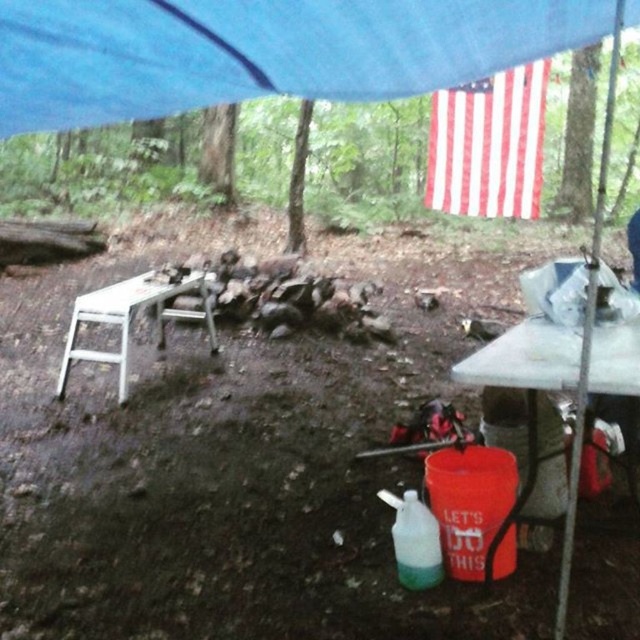
Question: Is red and white striped fabric at upper right wider than white metallic table at left?

Choices:
 (A) no
 (B) yes

Answer: (B)

Question: Which of these objects is positioned closest to the white metallic table at left?

Choices:
 (A) red and white striped fabric at upper right
 (B) orange plastic bucket at lower right

Answer: (B)

Question: Which is nearer to the white metallic table at left?

Choices:
 (A) orange plastic bucket at lower right
 (B) red and white striped fabric at upper right

Answer: (A)

Question: Can you confirm if red and white striped fabric at upper right is positioned below white metallic table at left?

Choices:
 (A) no
 (B) yes

Answer: (A)

Question: Which object is farther from the camera taking this photo?

Choices:
 (A) white metallic table at left
 (B) orange plastic bucket at lower right
 (C) red and white striped fabric at upper right

Answer: (C)

Question: Observing the image, what is the correct spatial positioning of red and white striped fabric at upper right in reference to orange plastic bucket at lower right?

Choices:
 (A) left
 (B) right

Answer: (B)